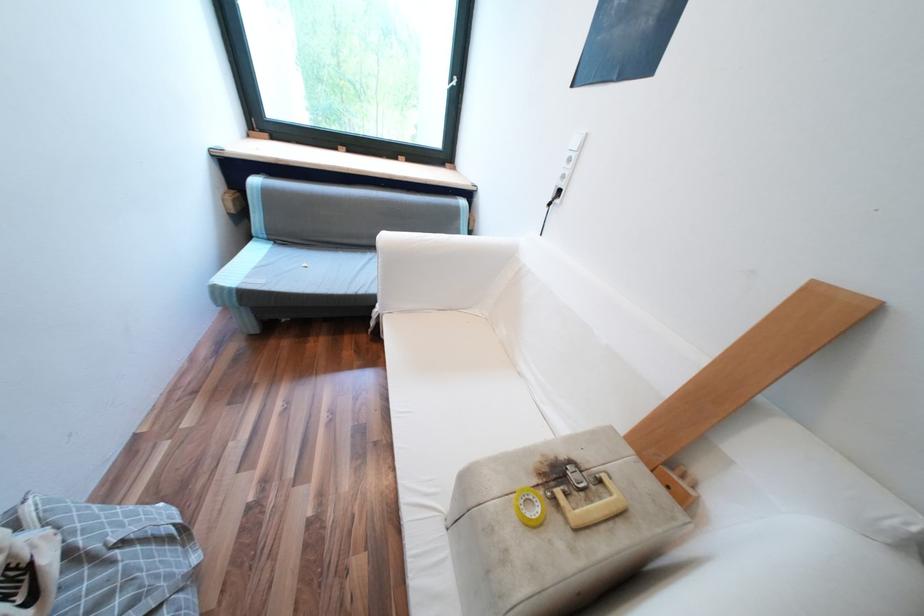
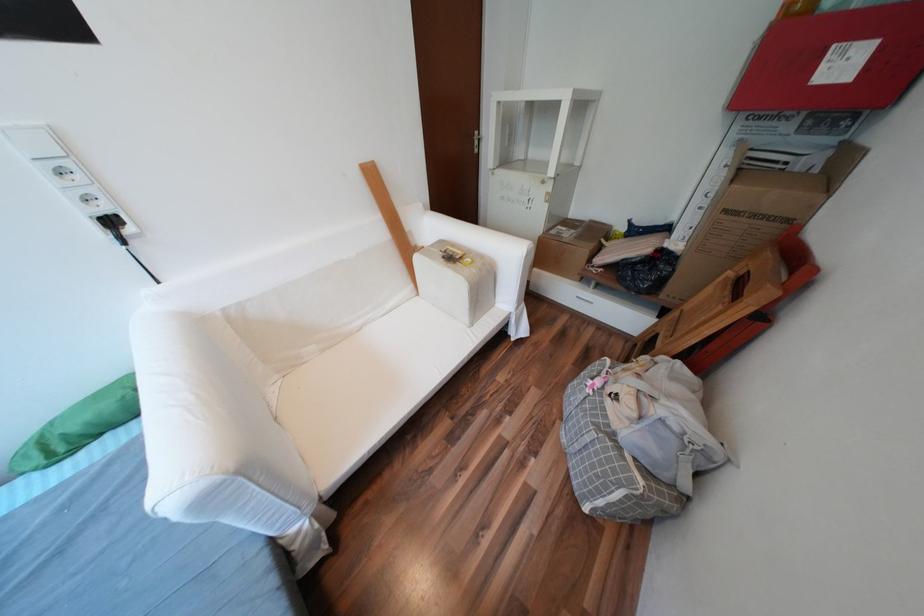
Where in the second image is the point corresponding to (566,200) from the first image?

(138, 231)